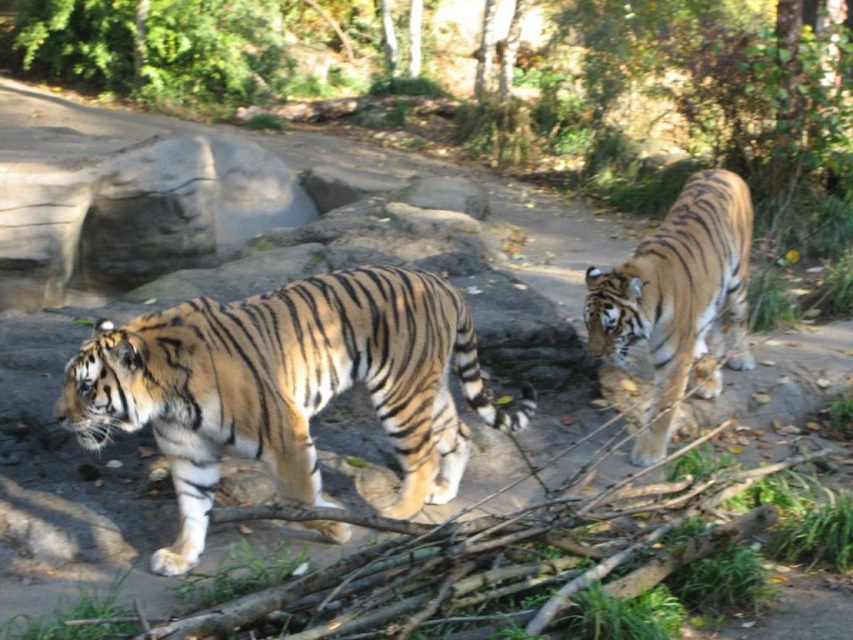
Does orange-brown striped tiger at left have a smaller size compared to orange-brown striped tiger at right?

Correct, orange-brown striped tiger at left occupies less space than orange-brown striped tiger at right.

Is orange-brown striped tiger at left to the right of orange-brown striped tiger at right from the viewer's perspective?

No, orange-brown striped tiger at left is not to the right of orange-brown striped tiger at right.

Is point (250, 449) closer to camera compared to point (611, 344)?

Yes, it is in front of point (611, 344).

The height and width of the screenshot is (640, 853). Find the location of `orange-brown striped tiger at left`. orange-brown striped tiger at left is located at coordinates (287, 387).